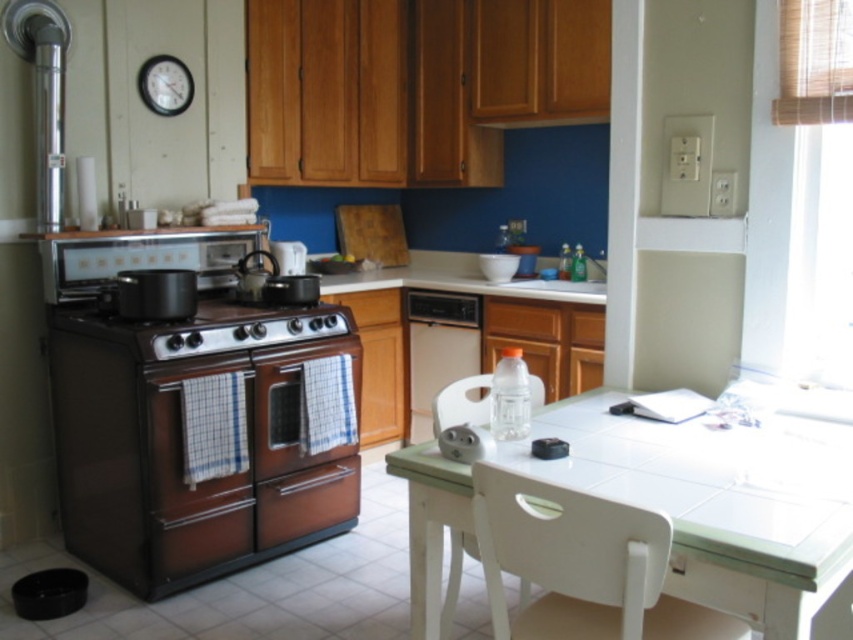
Is brown glossy gas stove at center-left thinner than satin white dishwasher at center?

Incorrect, brown glossy gas stove at center-left's width is not less than satin white dishwasher at center's.

Which is in front, point (231, 328) or point (409, 378)?

Point (231, 328) is in front.

Is point (189, 342) less distant than point (424, 330)?

Yes, point (189, 342) is in front of point (424, 330).

At what (x,y) coordinates should I click in order to perform the action: click on brown glossy gas stove at center-left. Please return your answer as a coordinate pair (x, y). The image size is (853, 640). Looking at the image, I should click on (210, 328).

What do you see at coordinates (718, 500) in the screenshot?
I see `white tile table at lower right` at bounding box center [718, 500].

Is point (421, 608) positioned behind point (434, 340)?

That is False.

Where is `white tile table at lower right`? Image resolution: width=853 pixels, height=640 pixels. white tile table at lower right is located at coordinates (718, 500).

Does brown glossy oven at left have a larger size compared to white tile table at lower right?

Correct, brown glossy oven at left is larger in size than white tile table at lower right.

Does brown glossy oven at left have a lesser width compared to white tile table at lower right?

In fact, brown glossy oven at left might be wider than white tile table at lower right.

This screenshot has height=640, width=853. I want to click on brown glossy oven at left, so click(186, 438).